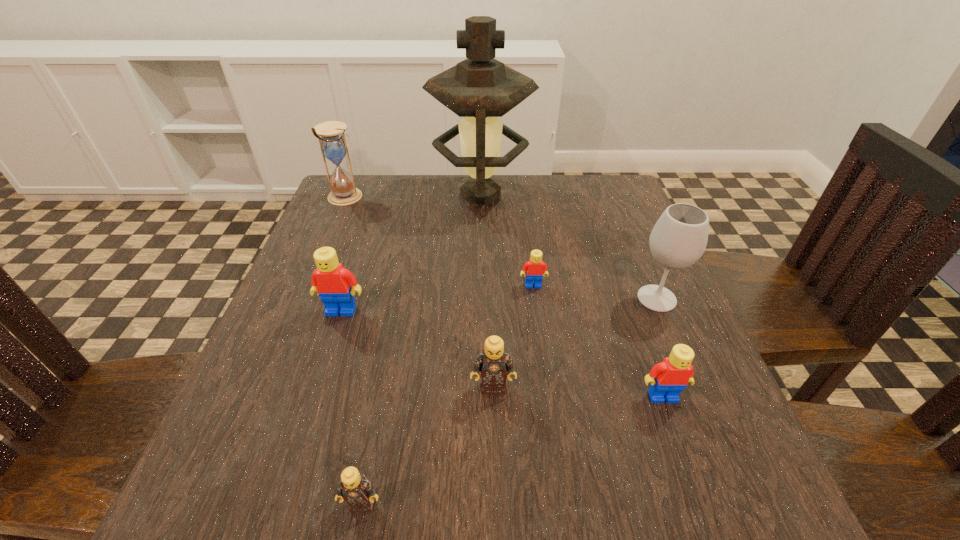
Choose which red Lego is the nearest neighbor to the smaller tan Lego. Please provide its 2D coordinates. Your answer should be formatted as a tuple, i.e. [(x, y)], where the tuple contains the x and y coordinates of a point satisfying the conditions above.

[(333, 282)]

Image resolution: width=960 pixels, height=540 pixels. I want to click on vacant space that satisfies the following two spatial constraints: 1. on the face of the farthest red Lego; 2. on the left side of the wineglass, so click(535, 299).